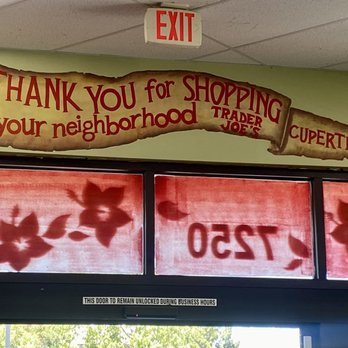
In order to click on ceiling in this screenshot , I will do `click(281, 20)`.